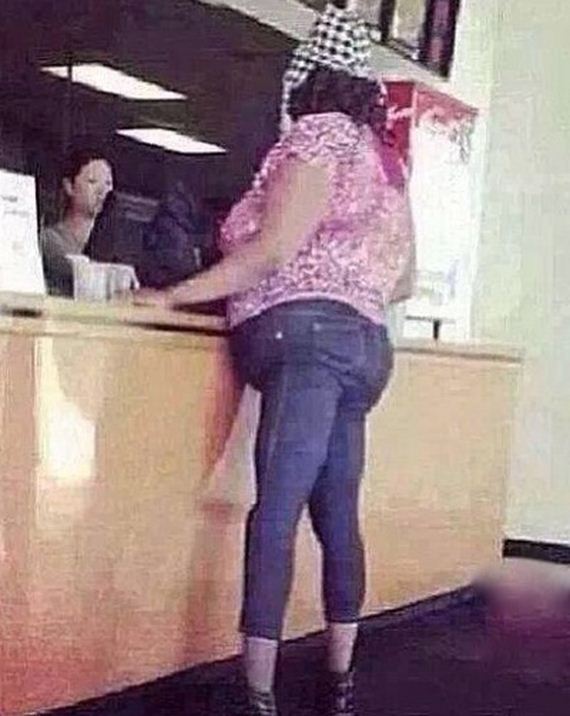
The width and height of the screenshot is (570, 716). Identify the location of ceiling. (222, 81).